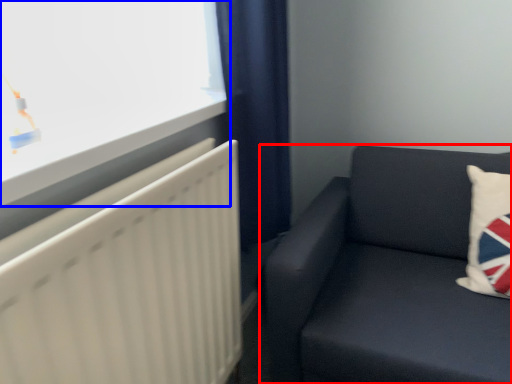
Question: Which point is further to the camera, studio couch (highlighted by a red box) or window (highlighted by a blue box)?

Choices:
 (A) studio couch
 (B) window

Answer: (A)